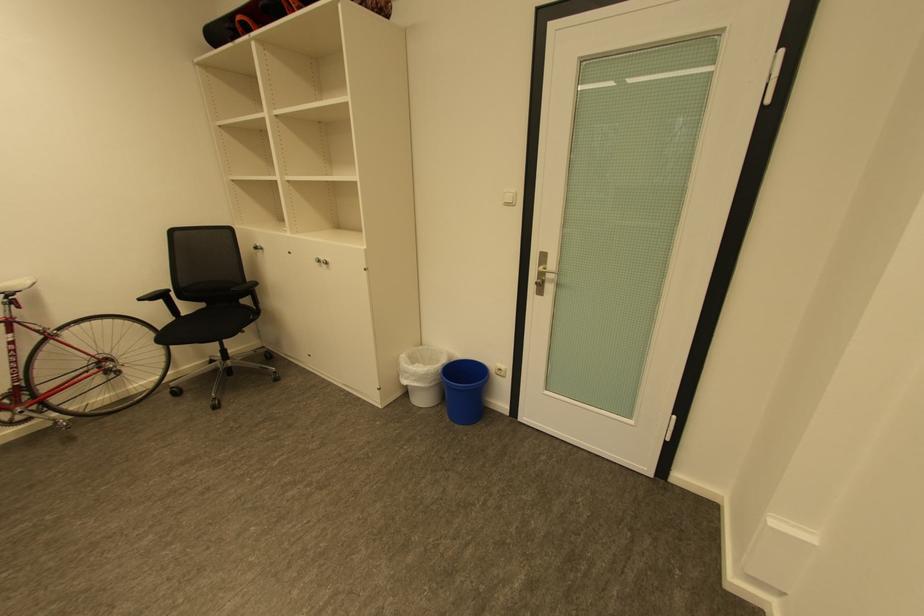
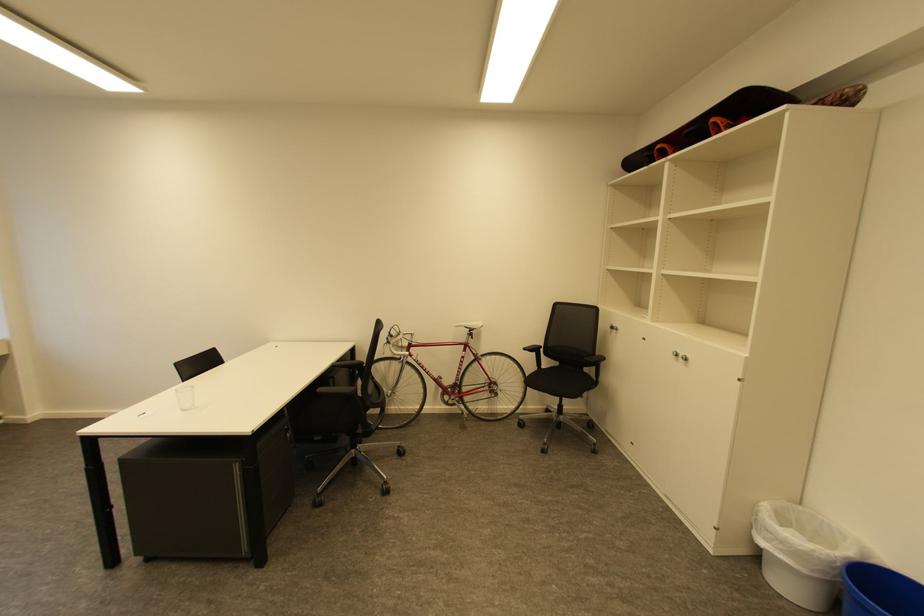
The point at (453, 365) is marked in the first image. Where is the corresponding point in the second image?

(860, 561)